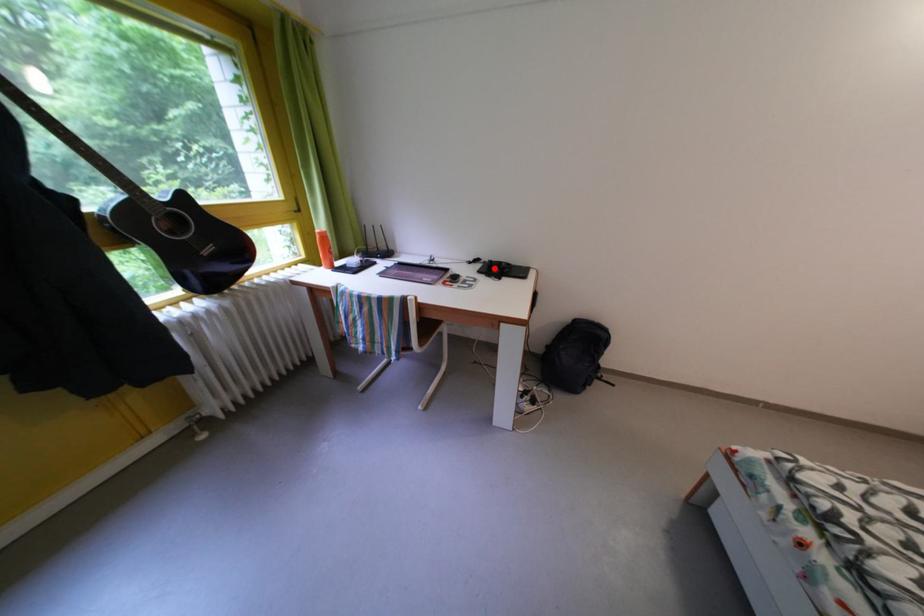
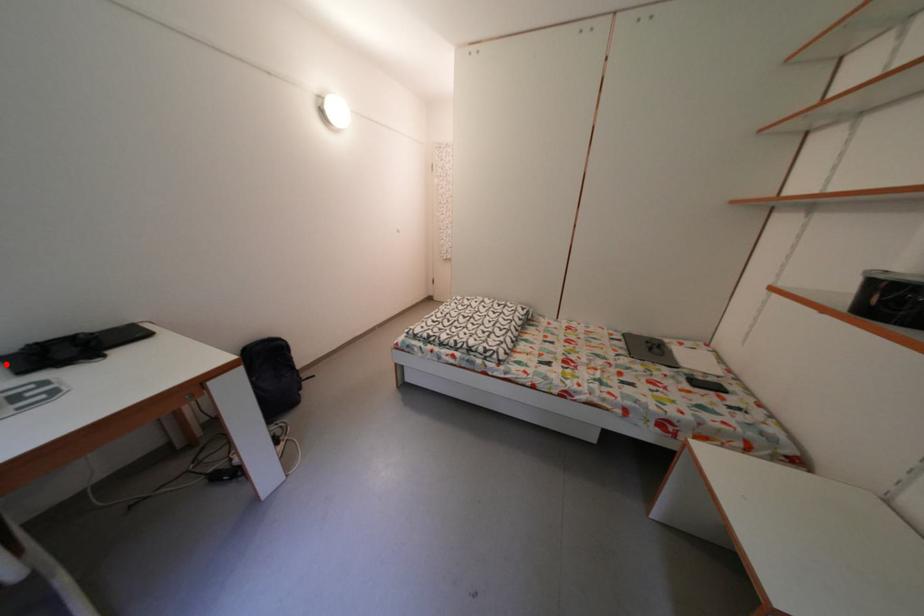
I am providing you with two images of the same scene from different viewpoints. A red point is marked on the first image and another point is marked on the second image. Does the point marked in image1 correspond to the same location as the one in image2?

Yes